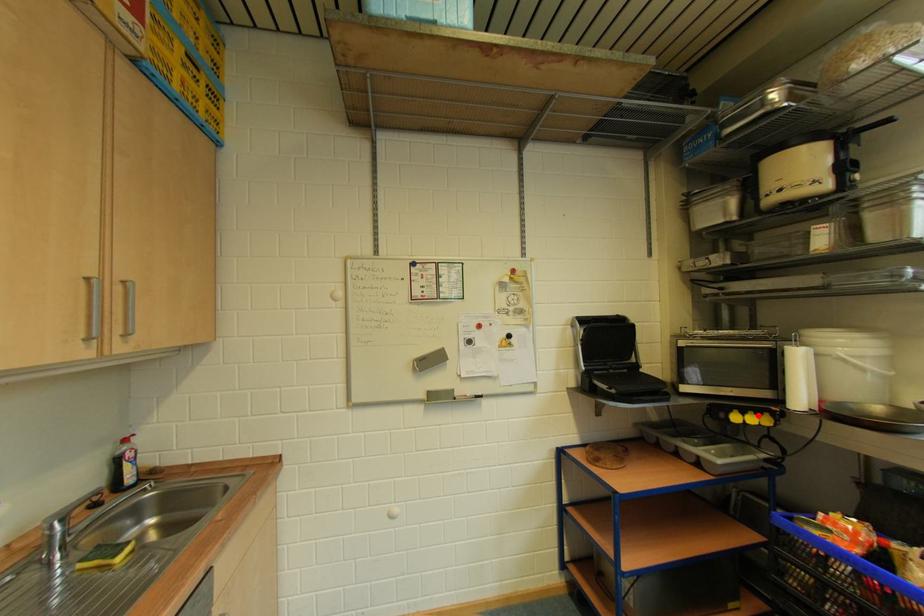
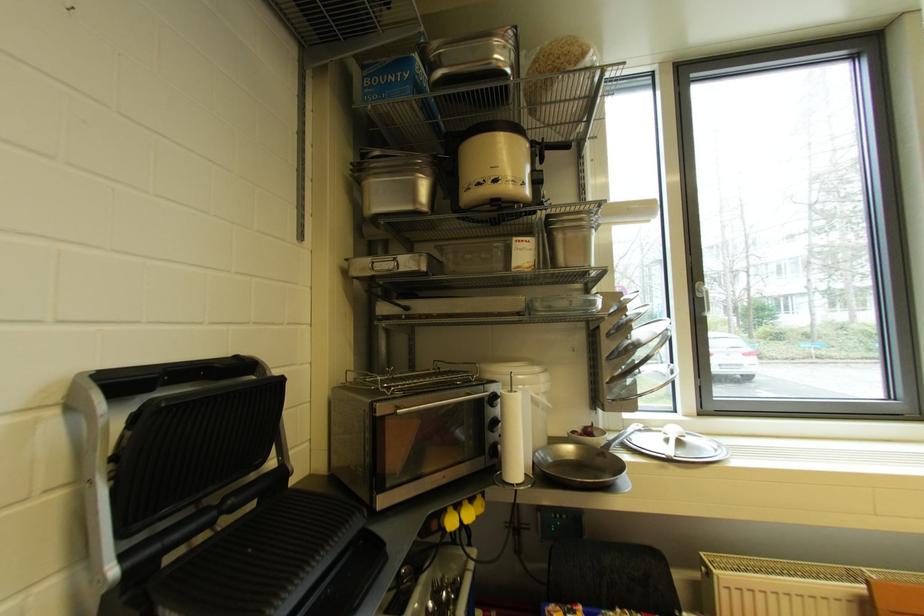
In the second image, find the point that corresponds to the highlighted location in the first image.

(472, 505)